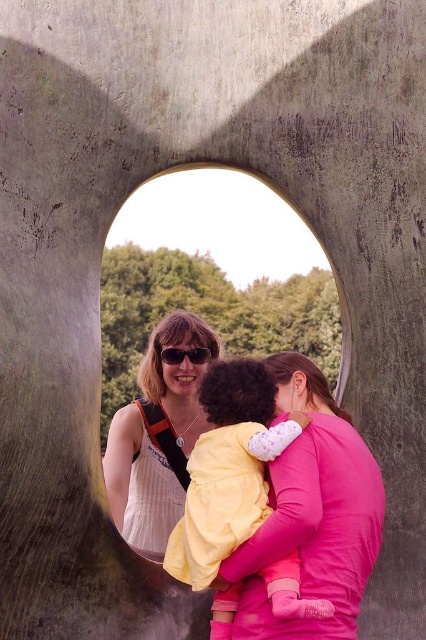
Question: Which object is the farthest from the white striped dress at center?

Choices:
 (A) concrete wall at center
 (B) matte black sunglasses at center
 (C) yellow fabric baby at center

Answer: (A)

Question: Estimate the real-world distances between objects in this image. Which object is closer to the yellow fabric baby at center?

Choices:
 (A) white striped dress at center
 (B) matte black sunglasses at center

Answer: (B)

Question: Is yellow fabric baby at center positioned at the back of matte black sunglasses at center?

Choices:
 (A) yes
 (B) no

Answer: (B)

Question: Observing the image, what is the correct spatial positioning of concrete wall at center in reference to matte black sunglasses at center?

Choices:
 (A) right
 (B) left

Answer: (A)

Question: Which object is farther from the camera taking this photo?

Choices:
 (A) concrete wall at center
 (B) yellow fabric baby at center
 (C) white striped dress at center

Answer: (C)

Question: Does yellow fabric baby at center lie in front of white striped dress at center?

Choices:
 (A) no
 (B) yes

Answer: (B)